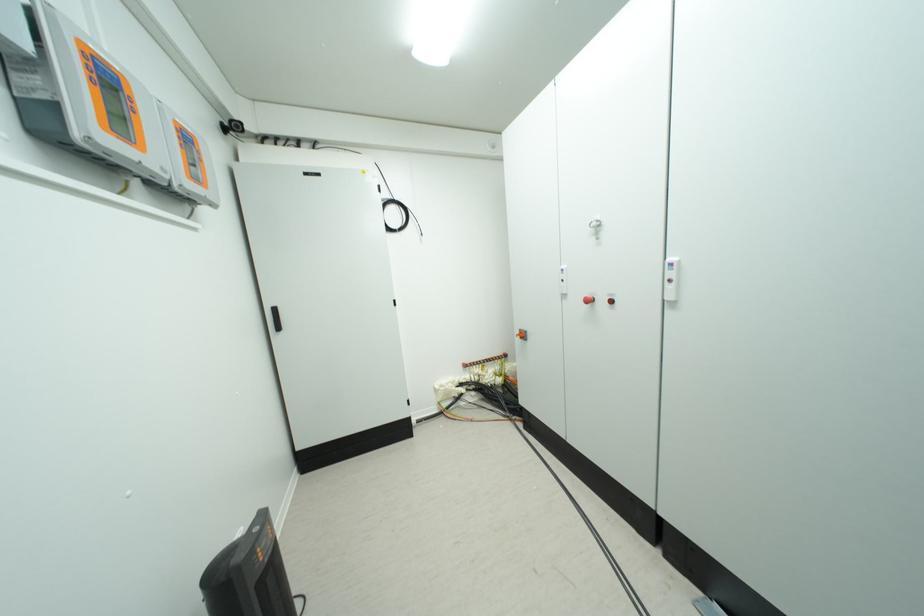
What do you see at coordinates (275, 318) in the screenshot?
I see `a white cabinet handle` at bounding box center [275, 318].